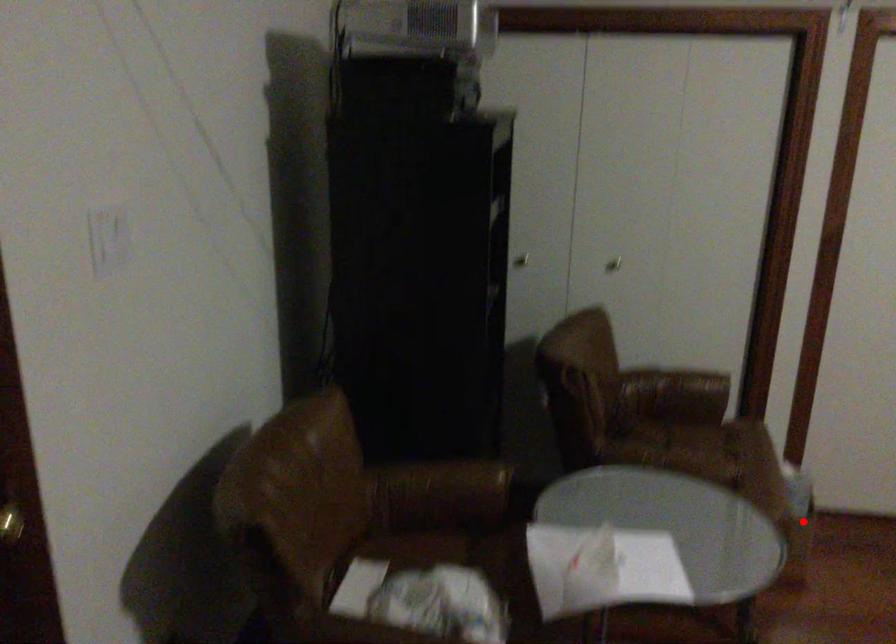
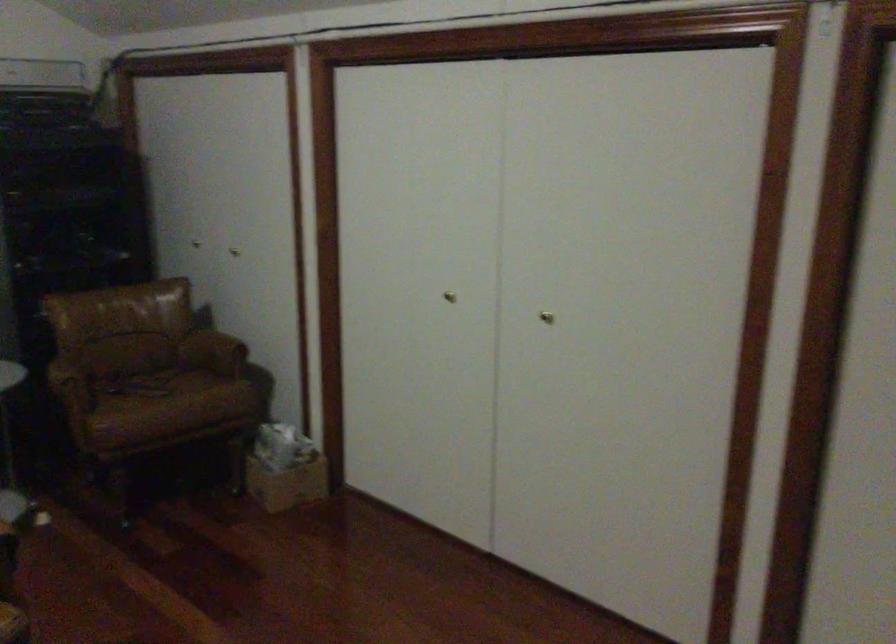
Locate, in the second image, the point that corresponds to the highlighted location in the first image.

(287, 484)